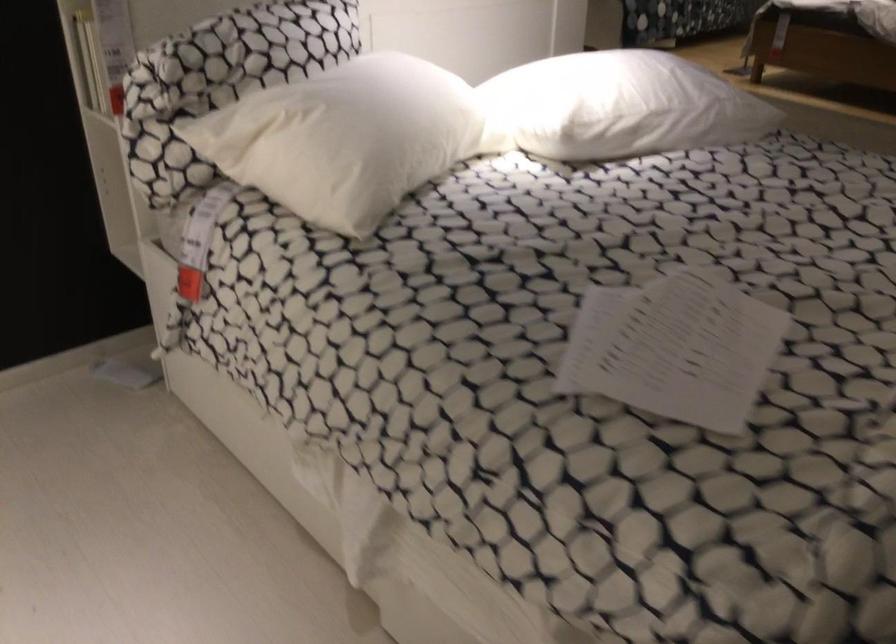
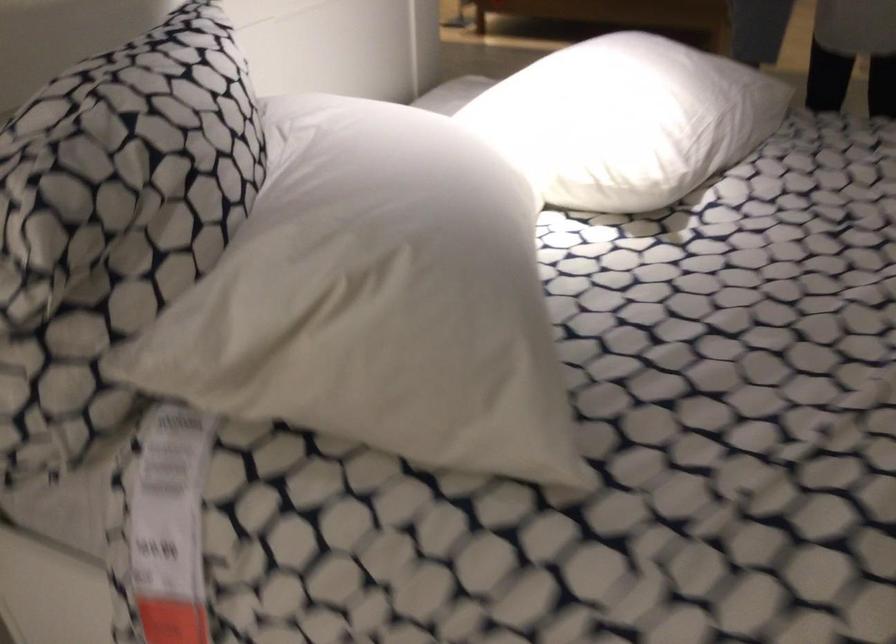
Question: The images are taken continuously from a first-person perspective. In which direction is your viewpoint rotating?

Choices:
 (A) Left
 (B) Right
 (C) Up
 (D) Down

Answer: (B)